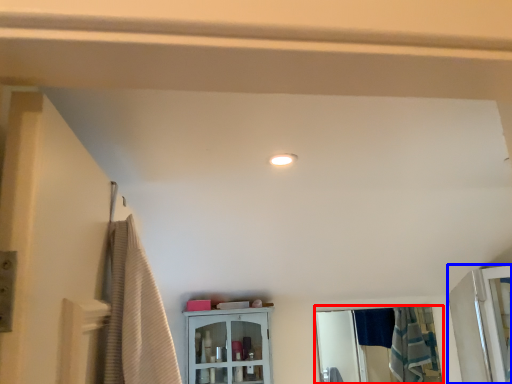
Question: Which object appears closest to the camera in this image, mirror (highlighted by a red box) or screen door (highlighted by a blue box)?

Choices:
 (A) mirror
 (B) screen door

Answer: (B)